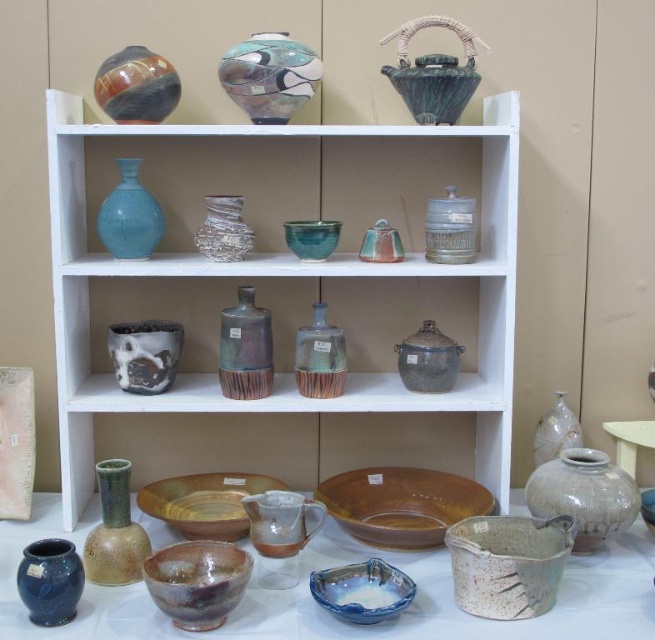
Question: Which point appears farthest from the camera in this image?

Choices:
 (A) (267, 316)
 (B) (195, 236)
 (C) (352, 481)
 (D) (559, 416)

Answer: (D)

Question: Does translucent glass vase at upper center appear on the right side of translucent glass vase at center-right?

Choices:
 (A) yes
 (B) no

Answer: (B)

Question: Estimate the real-world distances between objects in this image. Which object is farther from the speckled clay jar at lower right?

Choices:
 (A) white glossy table at lower right
 (B) matte blue glass vase at upper left
 (C) rusty metallic vase at center

Answer: (B)

Question: Which object appears farthest from the camera in this image?

Choices:
 (A) rustic ceramic vase at center
 (B) green matte teapot at upper center

Answer: (A)

Question: Does speckled clay pot at lower center lie behind matte gray jar at center-right?

Choices:
 (A) yes
 (B) no

Answer: (B)

Question: Does brown glazed plate at center have a smaller size compared to blue glossy vase at lower left?

Choices:
 (A) yes
 (B) no

Answer: (B)